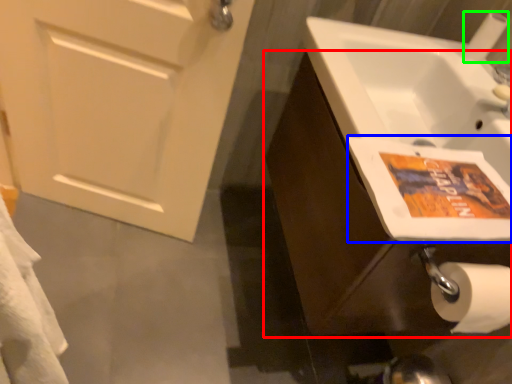
Question: Which object is the farthest from bathroom cabinet (highlighted by a red box)? Choose among these: flyer (highlighted by a blue box) or toilet paper (highlighted by a green box).

Choices:
 (A) flyer
 (B) toilet paper

Answer: (B)